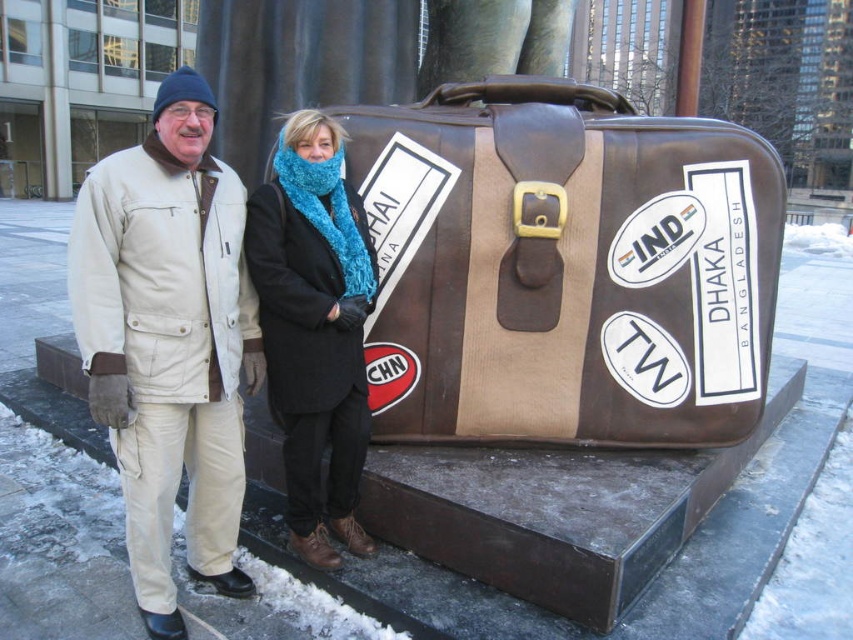
You are a photographer trying to capture both the brown leather suitcase at center and the knitted blue scarf at center in a single frame. Based on their sizes, which object should you focus on to ensure both fit in the photo?

The brown leather suitcase at center might be wider than knitted blue scarf at center, so focusing on the suitcase will ensure both objects fit in the frame.

You are a photographer trying to capture both the beige cotton jacket at left and the knitted blue scarf at center in a single shot. Based on their positions, which object should you focus on first to ensure both are in frame?

The beige cotton jacket at left is positioned under the knitted blue scarf at center, so focusing on the knitted blue scarf at center first will allow the camera to adjust the framing to include both objects.

You are standing in front of the large brown suitcase sculpture with travel stickers. You notice two points marked on the ground at coordinates point (155, 308) and point (315, 268). If you want to move from the first point to the second point, which direction should you walk relative to the sculpture?

You should walk towards the back of the sculpture because point (155, 308) is in front of point (315, 268), so moving from the first to the second requires going backward relative to the sculpture.